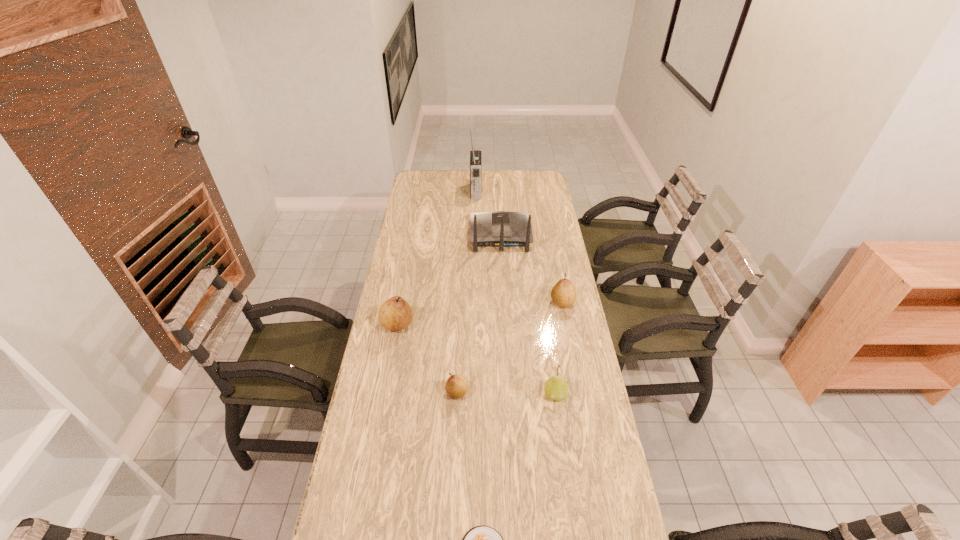
Identify the location of object at the left edge. This screenshot has height=540, width=960. (395, 314).

At what (x,y) coordinates should I click in order to perform the action: click on router that is at the right edge. Please return your answer as a coordinate pair (x, y). This screenshot has height=540, width=960. Looking at the image, I should click on (501, 229).

In the image, there is a desktop. At what (x,y) coordinates should I click in order to perform the action: click on free space at the far edge. Please return your answer as a coordinate pair (x, y). Looking at the image, I should click on (513, 190).

In the image, there is a desktop. Where is `vacant region at the left edge`? vacant region at the left edge is located at coordinates (397, 242).

This screenshot has width=960, height=540. Identify the location of vacant region at the right edge of the desktop. (542, 265).

In order to click on vacant region at the far left corner of the desktop in this screenshot , I will do `click(418, 176)`.

Locate an element on the screen. Image resolution: width=960 pixels, height=540 pixels. free point at the far right corner is located at coordinates (545, 188).

This screenshot has height=540, width=960. I want to click on free space between the green pear and the second farthest object, so tap(528, 315).

Identify the location of free space between the nearest brown pear and the router. This screenshot has width=960, height=540. (479, 314).

The height and width of the screenshot is (540, 960). I want to click on empty location between the third farthest object and the third nearest pear, so click(x=480, y=314).